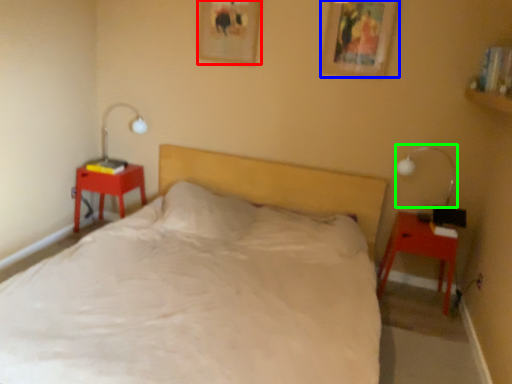
Question: Which object is the farthest from picture frame (highlighted by a red box)? Choose among these: picture frame (highlighted by a blue box) or bedside lamp (highlighted by a green box).

Choices:
 (A) picture frame
 (B) bedside lamp

Answer: (B)